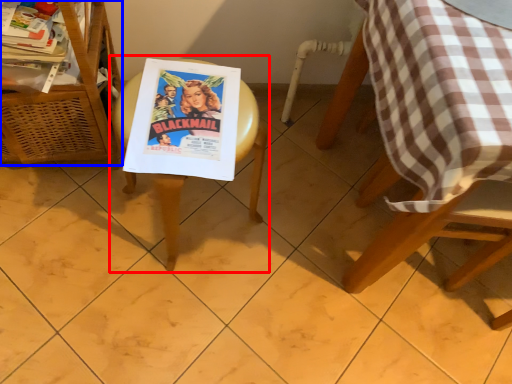
Question: Which point is further to the camera, picnic table (highlighted by a red box) or furniture (highlighted by a blue box)?

Choices:
 (A) picnic table
 (B) furniture

Answer: (A)